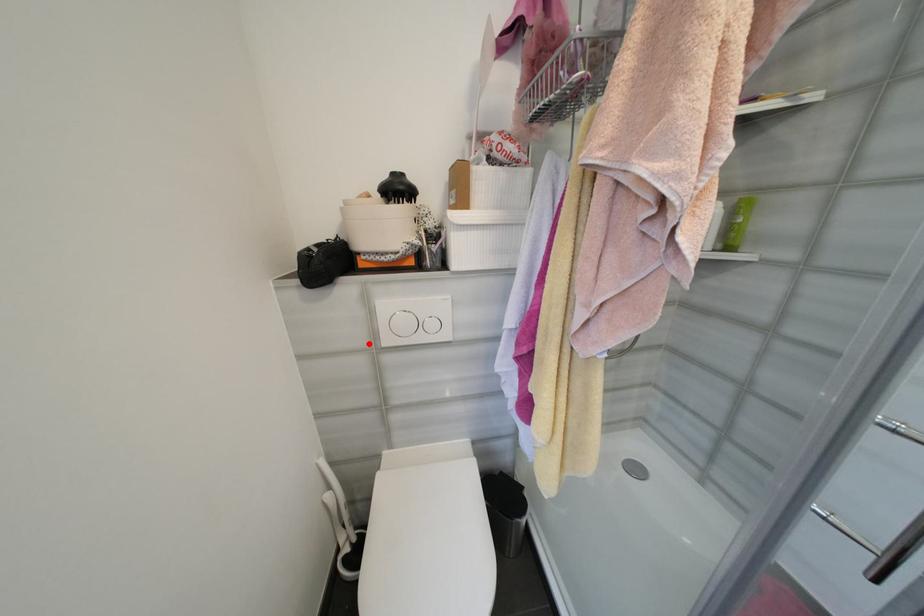
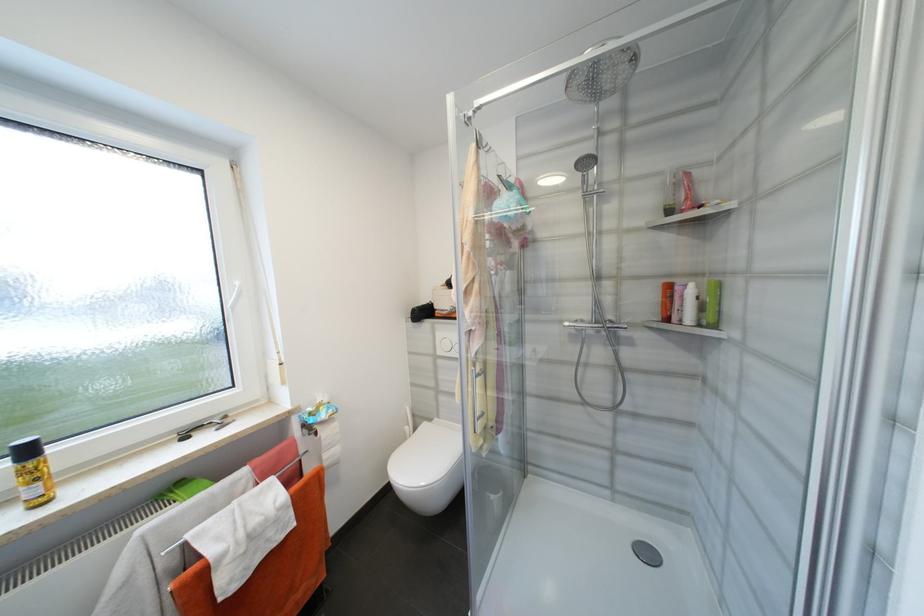
Find the pixel in the second image that matches the highlighted location in the first image.

(436, 352)